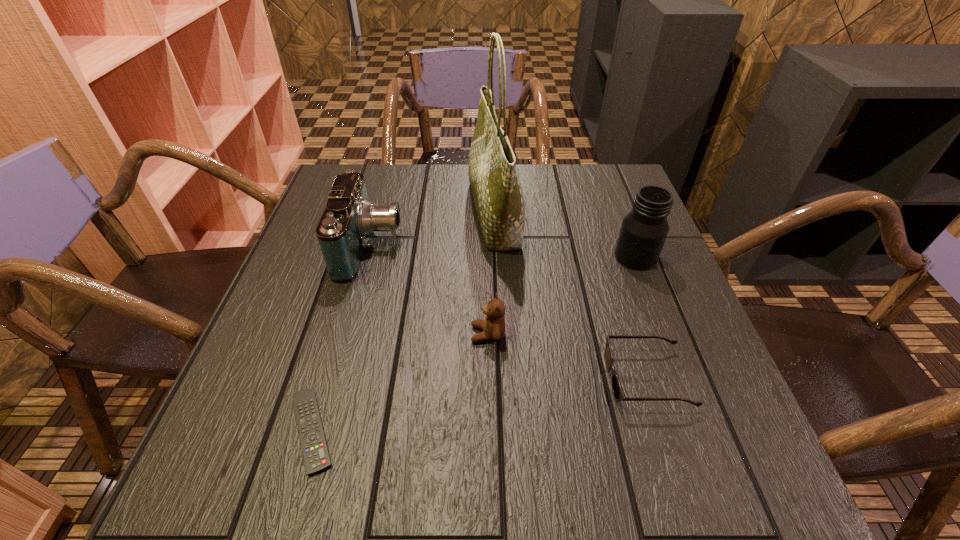
Image resolution: width=960 pixels, height=540 pixels. I want to click on jar located at the right edge, so click(x=644, y=229).

You are a GUI agent. You are given a task and a screenshot of the screen. Output one action in this format:
    pyautogui.click(x=<x>, y=<y>)
    Task: Click on the sunglasses located in the right edge section of the desktop
    The height and width of the screenshot is (540, 960).
    Given the screenshot: What is the action you would take?
    pyautogui.click(x=617, y=390)

At what (x,y) coordinates should I click in order to perform the action: click on object located at the near left corner. Please return your answer as a coordinate pair (x, y). This screenshot has height=540, width=960. Looking at the image, I should click on (316, 456).

Where is `free space at the near edge of the desktop`? free space at the near edge of the desktop is located at coordinates (317, 490).

What are the coordinates of `vacant area at the left edge` in the screenshot? It's located at (314, 252).

This screenshot has height=540, width=960. In order to click on vacant space at the right edge of the desktop in this screenshot , I will do `click(636, 299)`.

Image resolution: width=960 pixels, height=540 pixels. In the image, there is a desktop. Find the location of `vacant space at the far right corner`. vacant space at the far right corner is located at coordinates (607, 200).

Image resolution: width=960 pixels, height=540 pixels. In order to click on empty space that is in between the camcorder and the shopping bag in this screenshot , I will do `click(433, 230)`.

Locate an element on the screen. vacant area that lies between the jar and the second shortest object is located at coordinates (641, 318).

The height and width of the screenshot is (540, 960). What are the coordinates of `vacant region between the fifth tallest object and the shopping bag` in the screenshot? It's located at click(570, 296).